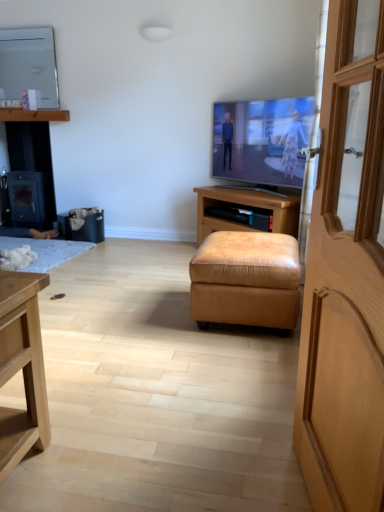
Where is `blank space situated above tan leather ottoman at center (from a real-world perspective)`? blank space situated above tan leather ottoman at center (from a real-world perspective) is located at coordinates (249, 234).